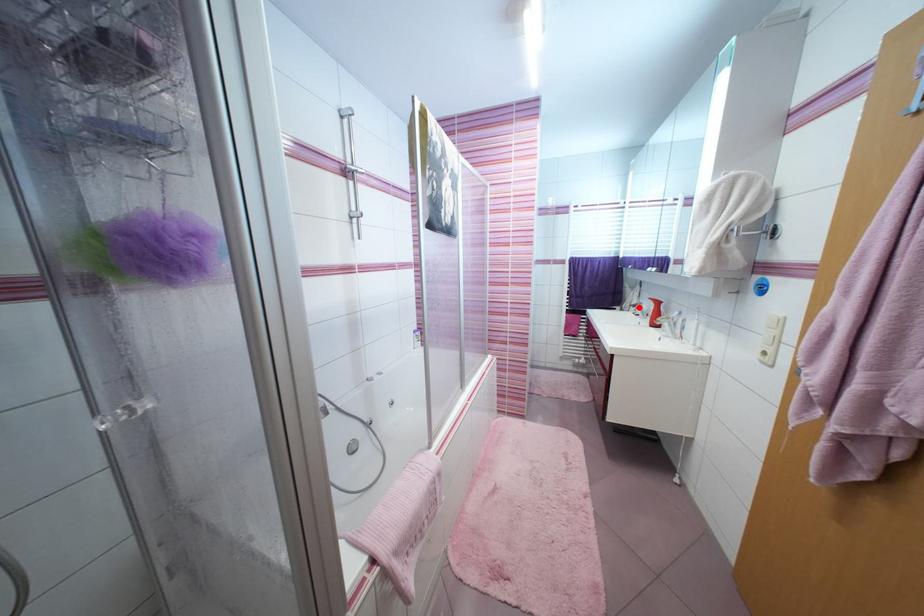
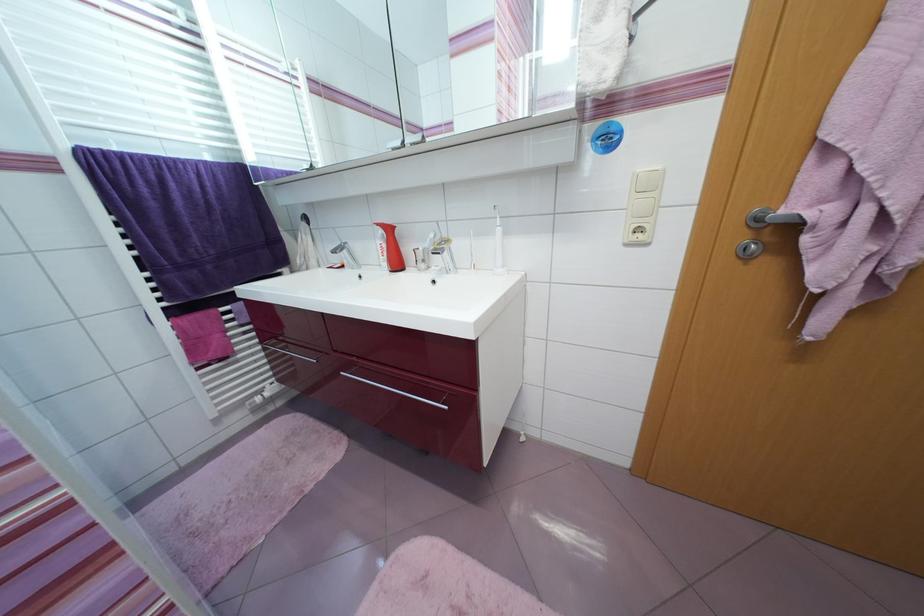
In the second image, find the point that corresponds to the highlighted location in the first image.

(338, 254)